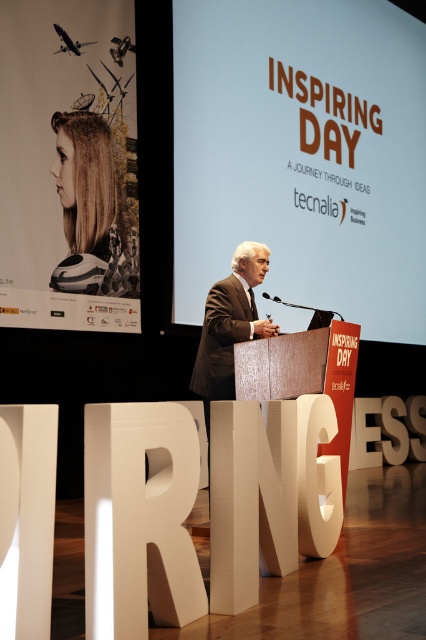
Does point (370, 42) come behind point (245, 269)?

Yes, it is behind point (245, 269).

Is white matte projection screen at upper center to the right of dark brown suit at center from the viewer's perspective?

Indeed, white matte projection screen at upper center is positioned on the right side of dark brown suit at center.

Who is more distant from viewer, (368,65) or (250,252)?

Point (368,65)

At what (x,y) coordinates should I click in order to perform the action: click on white matte projection screen at upper center. Please return your answer as a coordinate pair (x, y). This screenshot has width=426, height=640. Looking at the image, I should click on (302, 154).

Does white matte projection screen at upper center have a greater height compared to matte white poster at upper center?

Indeed, white matte projection screen at upper center has a greater height compared to matte white poster at upper center.

Locate an element on the screen. This screenshot has height=640, width=426. white matte projection screen at upper center is located at coordinates (302, 154).

The image size is (426, 640). Describe the element at coordinates (302, 154) in the screenshot. I see `white matte projection screen at upper center` at that location.

Identify the location of white matte projection screen at upper center. Image resolution: width=426 pixels, height=640 pixels. point(302,154).

Between matte white poster at upper center and dark brown suit at center, which one appears on the right side from the viewer's perspective?

dark brown suit at center

Looking at this image, can you confirm if matte white poster at upper center is wider than dark brown suit at center?

Yes, matte white poster at upper center is wider than dark brown suit at center.

Is point (40, 259) positioned behind point (250, 301)?

Yes, point (40, 259) is behind point (250, 301).

The width and height of the screenshot is (426, 640). In order to click on matte white poster at upper center in this screenshot , I will do `click(66, 170)`.